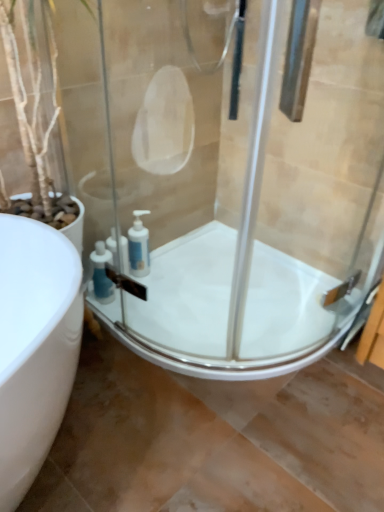
Question: Which direction should I rotate to look at blue plastic soap dispenser at lower center, the 2th soap dispenser when ordered from right to left, — up or down?

Choices:
 (A) down
 (B) up

Answer: (A)

Question: Can you confirm if white glossy bath at center is taller than transparent glass shower door at center?

Choices:
 (A) yes
 (B) no

Answer: (B)

Question: Does white glossy bath at center appear on the left side of transparent glass shower door at center?

Choices:
 (A) no
 (B) yes

Answer: (A)

Question: Considering the relative sizes of white glossy bath at center and transparent glass shower door at center in the image provided, is white glossy bath at center bigger than transparent glass shower door at center?

Choices:
 (A) no
 (B) yes

Answer: (A)

Question: Is white glossy bath at center facing away from transparent glass shower door at center?

Choices:
 (A) no
 (B) yes

Answer: (A)

Question: From a real-world perspective, is white glossy bath at center positioned under transparent glass shower door at center based on gravity?

Choices:
 (A) yes
 (B) no

Answer: (A)

Question: Is white glossy bath at center positioned far away from transparent glass shower door at center?

Choices:
 (A) yes
 (B) no

Answer: (B)

Question: Does white glossy bath at center appear on the right side of blue plastic soap dispenser at lower center, the 2th soap dispenser when ordered from right to left?

Choices:
 (A) no
 (B) yes

Answer: (B)

Question: Is white glossy bath at center oriented away from blue plastic soap dispenser at lower center, the 1th soap dispenser in the left-to-right sequence?

Choices:
 (A) no
 (B) yes

Answer: (A)

Question: From the image's perspective, would you say white glossy bath at center is positioned over blue plastic soap dispenser at lower center, the 1th soap dispenser in the left-to-right sequence?

Choices:
 (A) no
 (B) yes

Answer: (A)

Question: Considering the relative sizes of white glossy bath at center and blue plastic soap dispenser at lower center, the 1th soap dispenser in the left-to-right sequence, in the image provided, is white glossy bath at center bigger than blue plastic soap dispenser at lower center, the 1th soap dispenser in the left-to-right sequence,?

Choices:
 (A) no
 (B) yes

Answer: (B)

Question: From a real-world perspective, is white glossy bath at center beneath blue plastic soap dispenser at lower center, the 2th soap dispenser when ordered from right to left?

Choices:
 (A) no
 (B) yes

Answer: (B)

Question: From the image's perspective, does white glossy bath at center appear lower than blue plastic soap dispenser at lower center, the 2th soap dispenser when ordered from right to left?

Choices:
 (A) yes
 (B) no

Answer: (A)

Question: Is transparent glass shower door at center facing away from white glossy bath at center?

Choices:
 (A) yes
 (B) no

Answer: (A)